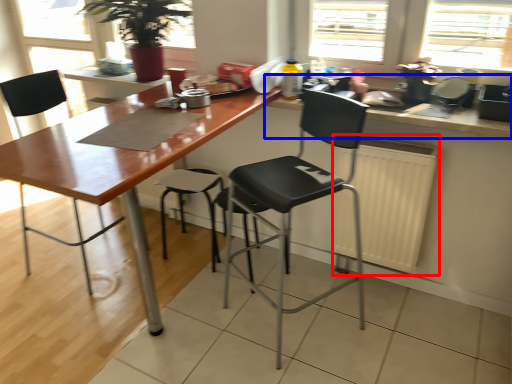
Question: Among these objects, which one is nearest to the camera, radiator (highlighted by a red box) or countertop (highlighted by a blue box)?

Choices:
 (A) radiator
 (B) countertop

Answer: (B)